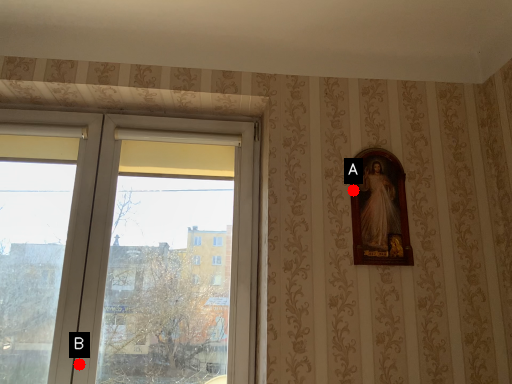
Question: Two points are circled on the image, labeled by A and B beside each circle. Which point appears closest to the camera in this image?

Choices:
 (A) A is closer
 (B) B is closer

Answer: (B)